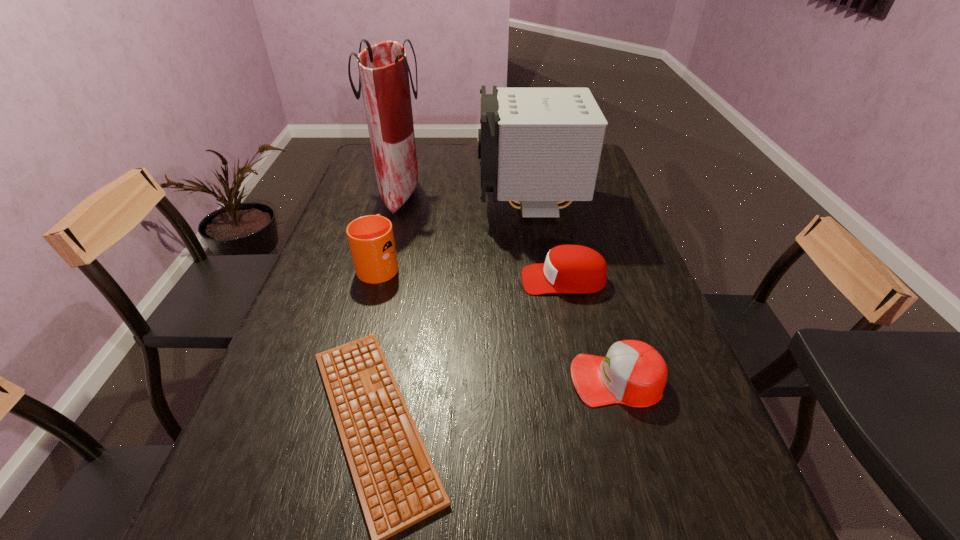
This screenshot has width=960, height=540. In order to click on grocery bag in this screenshot , I will do [383, 69].

Where is `the second tallest object`? This screenshot has height=540, width=960. the second tallest object is located at coordinates (537, 146).

I want to click on mug, so click(x=371, y=239).

I want to click on the farther baseball cap, so click(574, 269).

Find the location of `the nearer baseball cap`. the nearer baseball cap is located at coordinates (633, 373).

Where is `vacant point located 0.050m on the back of the tallest object`? Image resolution: width=960 pixels, height=540 pixels. vacant point located 0.050m on the back of the tallest object is located at coordinates tap(408, 164).

You are a GUI agent. You are given a task and a screenshot of the screen. Output one action in this format:
    pyautogui.click(x=<x>, y=<y>)
    Task: Click on the free point located on the front of the fan
    The height and width of the screenshot is (540, 960).
    Given the screenshot: What is the action you would take?
    (x=543, y=298)

Where is `vacant space situated 0.250m on the handle side of the fourth shortest object`? The image size is (960, 540). vacant space situated 0.250m on the handle side of the fourth shortest object is located at coordinates (396, 201).

What are the coordinates of `blank space located on the handle side of the fourth shortest object` in the screenshot? It's located at (392, 219).

What are the coordinates of `free spot located 0.400m on the handle side of the fourth shortest object` in the screenshot? It's located at (402, 179).